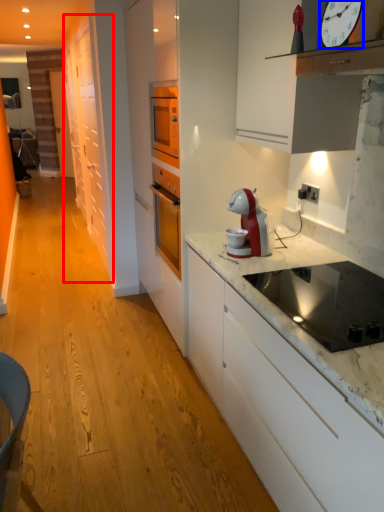
Question: Among these objects, which one is farthest to the camera, cabinetry (highlighted by a red box) or clock (highlighted by a blue box)?

Choices:
 (A) cabinetry
 (B) clock

Answer: (A)